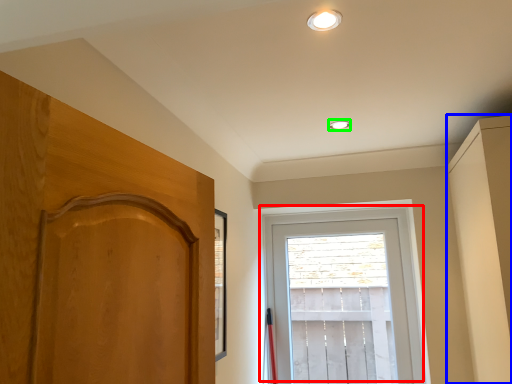
Question: Which object is the closest to the window (highlighted by a red box)? Choose among these: dresser (highlighted by a blue box) or lighting (highlighted by a green box).

Choices:
 (A) dresser
 (B) lighting

Answer: (A)